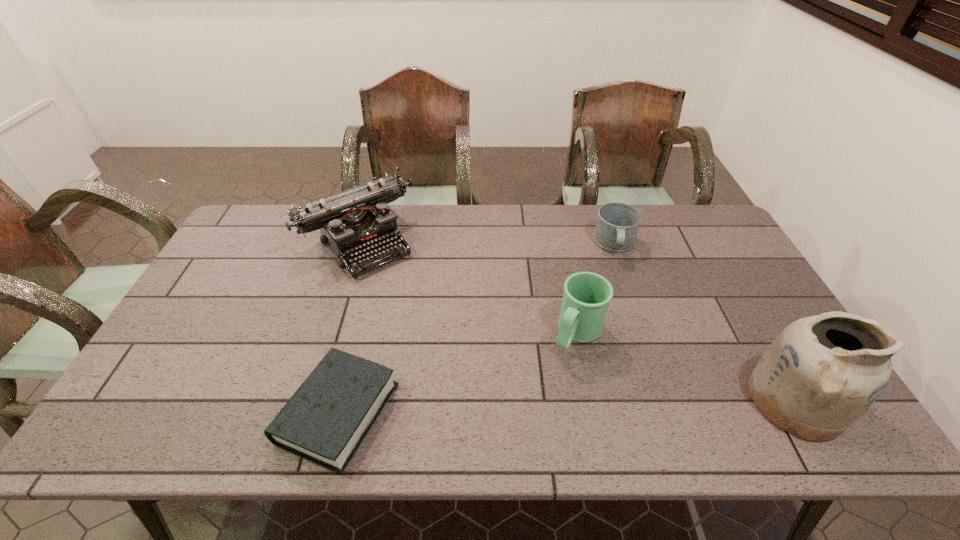
The height and width of the screenshot is (540, 960). Identify the location of Bible. (325, 421).

This screenshot has width=960, height=540. Identify the location of the rightmost object. (821, 373).

Where is `the tallest object`? This screenshot has width=960, height=540. the tallest object is located at coordinates (821, 373).

You are a GUI agent. You are given a task and a screenshot of the screen. Output one action in this format:
    pyautogui.click(x=<x>, y=<y>)
    Task: Click on the left mug
    The image size is (960, 540).
    Given the screenshot: What is the action you would take?
    pyautogui.click(x=587, y=295)

Find the location of a particular element. This screenshot has width=960, height=540. the nearer mug is located at coordinates (587, 295).

This screenshot has width=960, height=540. In order to click on typewriter in this screenshot , I will do `click(354, 222)`.

In order to click on the fourth object from left to right in this screenshot , I will do `click(617, 224)`.

You are a GUI agent. You are given a task and a screenshot of the screen. Output one action in this format:
    pyautogui.click(x=<x>, y=<y>)
    Task: Click on the right mug
    Image resolution: width=960 pixels, height=540 pixels.
    Given the screenshot: What is the action you would take?
    pyautogui.click(x=617, y=224)

You are a GUI agent. You are given a task and a screenshot of the screen. Output one action in this format:
    pyautogui.click(x=<x>, y=<y>)
    Task: Click on the free point located 0.170m on the back of the shortest object
    This screenshot has width=960, height=540.
    Given the screenshot: What is the action you would take?
    pyautogui.click(x=364, y=311)

What are the coordinates of `free location located 0.060m on the left of the rightmost object` in the screenshot? It's located at (x=725, y=400).